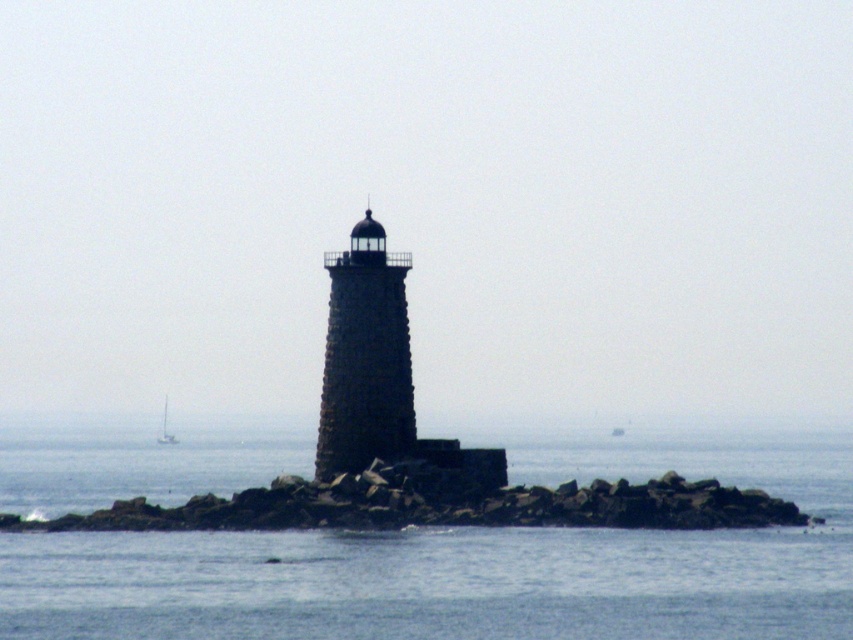
You are a sailor navigating a boat and you see the transparent water at center and the white matte sailboat at lower left. Which one is wider?

The transparent water at center might be wider than the white matte sailboat at lower left.

You are a marine biologist planning to swim from the rocky at center to the dark gray stone lighthouse at center. The safe swimming distance for you is up to 8 meters. Can you safely swim this distance?

The distance between the rocky at center and the dark gray stone lighthouse at center is 7.73 meters, which is within your safe swimming limit of 8 meters. Therefore, you can safely swim to the lighthouse.

You are a sailor approaching the lighthouse and need to determine the safest path. Based on the scene, which object is closer to you as you approach the lighthouse? Please choose between the rocky at center and the dark gray stone lighthouse at center.

The rocky at center is in front of the dark gray stone lighthouse at center, so the rocky at center is closer to you as you approach the lighthouse.